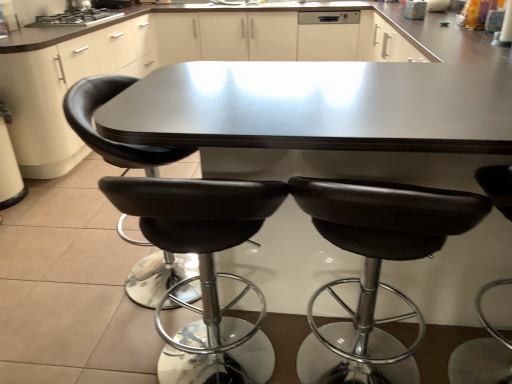
Question: In which direction should I rotate to look at black leather stool at center, arranged as the 2th chair when viewed from the right?

Choices:
 (A) right
 (B) left

Answer: (A)

Question: Is black leather chair at center, which ranks as the 2th chair in left-to-right order, touching black leather stool at center, which is the third chair in left-to-right order?

Choices:
 (A) no
 (B) yes

Answer: (A)

Question: Can you confirm if black leather chair at center, which ranks as the 2th chair in left-to-right order, is wider than black leather stool at center, which is the third chair in left-to-right order?

Choices:
 (A) yes
 (B) no

Answer: (B)

Question: Is black leather chair at center, which ranks as the 2th chair in left-to-right order, looking in the opposite direction of black leather stool at center, arranged as the 2th chair when viewed from the right?

Choices:
 (A) yes
 (B) no

Answer: (B)

Question: From a real-world perspective, is black leather chair at center, acting as the third chair starting from the right, below black leather stool at center, which is the third chair in left-to-right order?

Choices:
 (A) no
 (B) yes

Answer: (A)

Question: Considering the relative sizes of black leather chair at center, which ranks as the 2th chair in left-to-right order, and black leather stool at center, arranged as the 2th chair when viewed from the right, in the image provided, is black leather chair at center, which ranks as the 2th chair in left-to-right order, bigger than black leather stool at center, arranged as the 2th chair when viewed from the right,?

Choices:
 (A) no
 (B) yes

Answer: (B)

Question: Could you tell me if black leather chair at center, which ranks as the 2th chair in left-to-right order, is turned towards black leather stool at center, which is the third chair in left-to-right order?

Choices:
 (A) no
 (B) yes

Answer: (A)

Question: Is white matte dishwasher at upper center completely or partially inside black leather stool at right, arranged as the fourth chair when viewed from the left?

Choices:
 (A) no
 (B) yes

Answer: (A)

Question: From the image's perspective, is black leather stool at right, positioned as the first chair in right-to-left order, on top of white matte dishwasher at upper center?

Choices:
 (A) yes
 (B) no

Answer: (B)

Question: Does black leather stool at right, arranged as the fourth chair when viewed from the left, have a smaller size compared to white matte dishwasher at upper center?

Choices:
 (A) no
 (B) yes

Answer: (A)

Question: Can you confirm if black leather stool at right, arranged as the fourth chair when viewed from the left, is wider than white matte dishwasher at upper center?

Choices:
 (A) yes
 (B) no

Answer: (A)

Question: From the image's perspective, is black leather stool at right, arranged as the fourth chair when viewed from the left, under white matte dishwasher at upper center?

Choices:
 (A) yes
 (B) no

Answer: (A)

Question: Would you say black leather stool at right, positioned as the first chair in right-to-left order, is outside white matte dishwasher at upper center?

Choices:
 (A) no
 (B) yes

Answer: (B)

Question: Would you say white matte dishwasher at upper center is outside black leather chair at center, which ranks as the 2th chair in left-to-right order?

Choices:
 (A) yes
 (B) no

Answer: (A)